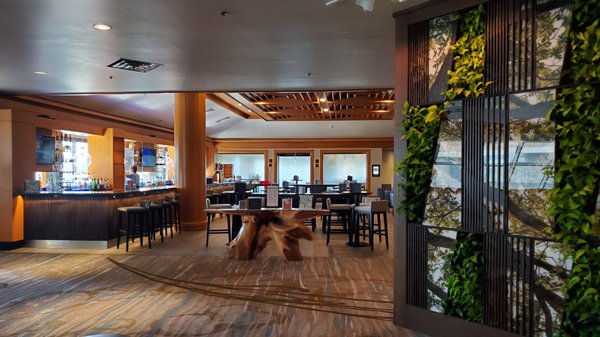
This screenshot has height=337, width=600. I want to click on barstools, so click(x=131, y=211), click(x=156, y=206), click(x=170, y=201).